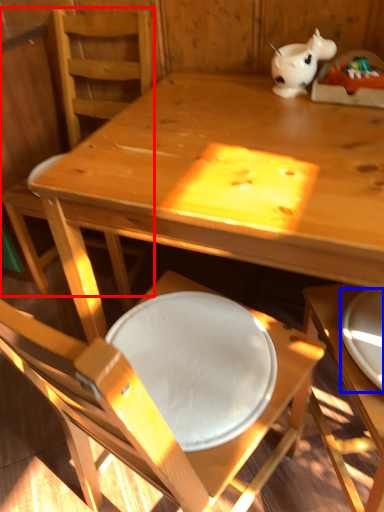
Question: Which of the following is the farthest to the observer, chair (highlighted by a red box) or plate (highlighted by a blue box)?

Choices:
 (A) chair
 (B) plate

Answer: (A)